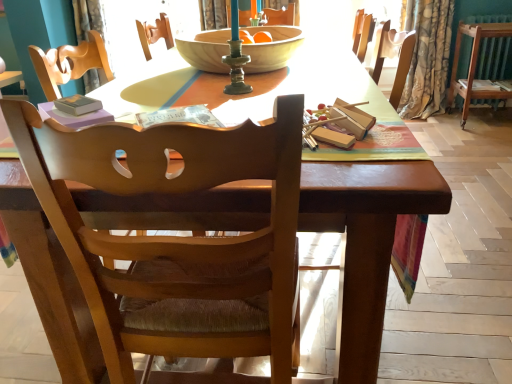
Question: Can you confirm if matte purple paperback book at right, the 2th paperback book in the bottom-to-top sequence, is smaller than hardcover book at upper left, marked as the 1th paperback book in a bottom-to-top arrangement?

Choices:
 (A) no
 (B) yes

Answer: (A)

Question: Could you tell me if matte purple paperback book at right, arranged as the 1th paperback book when viewed from the back, is turned towards hardcover book at upper left, arranged as the 1th paperback book when viewed from the left?

Choices:
 (A) no
 (B) yes

Answer: (A)

Question: Can you confirm if matte purple paperback book at right, which is the 2th paperback book in front-to-back order, is positioned to the left of hardcover book at upper left, arranged as the second paperback book when viewed from the right?

Choices:
 (A) no
 (B) yes

Answer: (A)

Question: From a real-world perspective, is matte purple paperback book at right, the 2th paperback book in the bottom-to-top sequence, beneath hardcover book at upper left, which is the second paperback book in top-to-bottom order?

Choices:
 (A) yes
 (B) no

Answer: (A)

Question: Are matte purple paperback book at right, which is the 1th paperback book in right-to-left order, and hardcover book at upper left, arranged as the 1th paperback book when viewed from the left, beside each other?

Choices:
 (A) no
 (B) yes

Answer: (A)

Question: Looking at the image, does floral fabric curtain at right, positioned as the 1th curtain in right-to-left order, seem bigger or smaller compared to green metallic candle holder at center?

Choices:
 (A) small
 (B) big

Answer: (B)

Question: Does point (423, 44) appear closer or farther from the camera than point (232, 51)?

Choices:
 (A) closer
 (B) farther

Answer: (B)

Question: Is floral fabric curtain at right, positioned as the 1th curtain in right-to-left order, wider or thinner than green metallic candle holder at center?

Choices:
 (A) wide
 (B) thin

Answer: (A)

Question: Is floral fabric curtain at right, positioned as the 1th curtain in right-to-left order, in front of or behind green metallic candle holder at center in the image?

Choices:
 (A) front
 (B) behind

Answer: (B)

Question: From a real-world perspective, is matte purple paperback book at right, arranged as the 1th paperback book when viewed from the back, physically located above or below floral fabric curtain at right, positioned as the 1th curtain in right-to-left order?

Choices:
 (A) below
 (B) above

Answer: (A)

Question: From their relative heights in the image, would you say matte purple paperback book at right, arranged as the 1th paperback book when viewed from the back, is taller or shorter than floral fabric curtain at right, arranged as the 2th curtain when viewed from the left?

Choices:
 (A) tall
 (B) short

Answer: (B)

Question: Is point (494, 82) closer or farther from the camera than point (451, 11)?

Choices:
 (A) closer
 (B) farther

Answer: (B)

Question: Is matte purple paperback book at right, which is the 2th paperback book in front-to-back order, in front of or behind floral fabric curtain at right, arranged as the 2th curtain when viewed from the left, in the image?

Choices:
 (A) behind
 (B) front

Answer: (A)

Question: In terms of size, does wooden bowl at center appear bigger or smaller than wooden chair at center?

Choices:
 (A) big
 (B) small

Answer: (B)

Question: Is point (197, 61) closer or farther from the camera than point (52, 137)?

Choices:
 (A) closer
 (B) farther

Answer: (B)